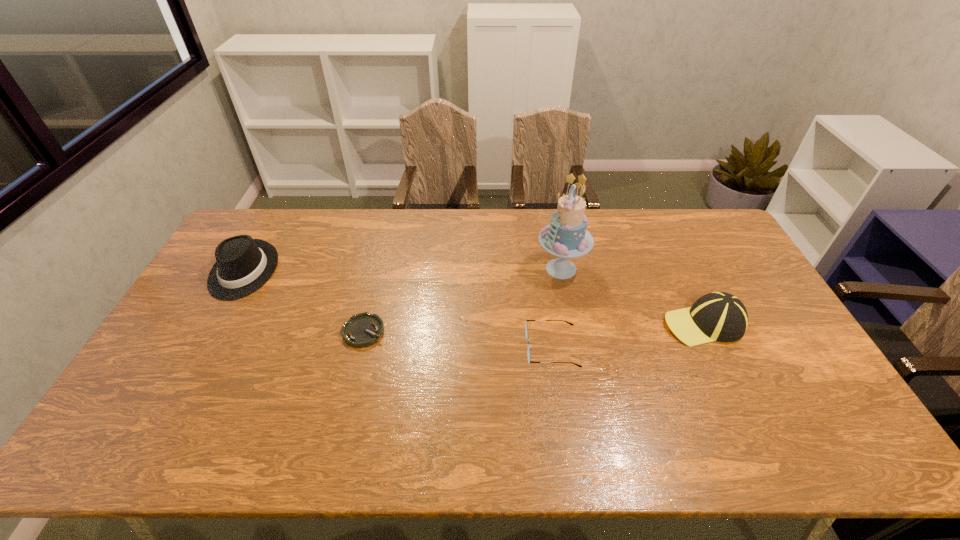
Find the location of a particular element. vacant space situated 0.140m with the brim of the baseball cap facing forward is located at coordinates (616, 324).

This screenshot has width=960, height=540. In order to click on vacant space situated 0.050m with the brim of the baseball cap facing forward in this screenshot , I will do `click(647, 324)`.

Where is `vacant space located 0.180m with the brim of the baseball cap facing forward`? The image size is (960, 540). vacant space located 0.180m with the brim of the baseball cap facing forward is located at coordinates (603, 324).

The image size is (960, 540). Identify the location of vacant area located 0.150m on the lenses of the second shortest object. (473, 348).

Identify the location of vacant area situated on the lenses of the second shortest object. (505, 348).

Identify the location of vacant space located 0.310m on the lenses of the second shortest object. (417, 348).

Locate an element on the screen. Image resolution: width=960 pixels, height=540 pixels. vacant space located 0.190m on the front of the ashtray is located at coordinates (345, 409).

The width and height of the screenshot is (960, 540). In order to click on object at the far edge in this screenshot , I will do `click(243, 265)`.

Where is `object that is at the left edge`? This screenshot has height=540, width=960. object that is at the left edge is located at coordinates (243, 265).

Locate an element on the screen. object situated at the right edge is located at coordinates (718, 316).